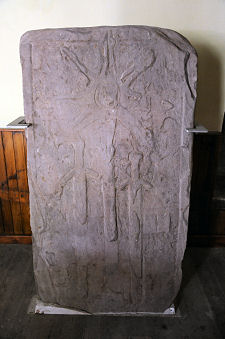
You are a GUI agent. You are given a task and a screenshot of the screen. Output one action in this format:
    pyautogui.click(x=<x>, y=<y>)
    Task: Click on the wall
    
    Given the screenshot: What is the action you would take?
    pyautogui.click(x=115, y=8)